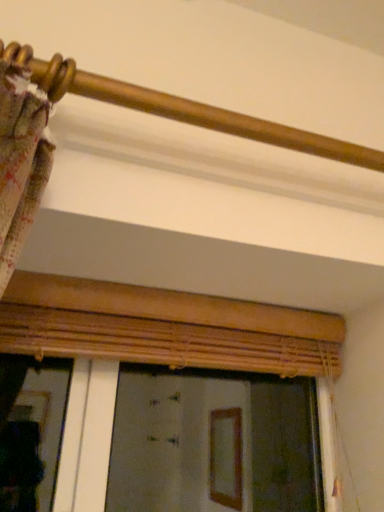
Question: Is wooden blinds at center directly adjacent to gold polished rod at upper center?

Choices:
 (A) no
 (B) yes

Answer: (A)

Question: Does wooden blinds at center have a lesser width compared to gold polished rod at upper center?

Choices:
 (A) yes
 (B) no

Answer: (B)

Question: Can we say wooden blinds at center lies outside gold polished rod at upper center?

Choices:
 (A) no
 (B) yes

Answer: (B)

Question: Can you confirm if wooden blinds at center is wider than gold polished rod at upper center?

Choices:
 (A) yes
 (B) no

Answer: (A)

Question: From a real-world perspective, is wooden blinds at center on top of gold polished rod at upper center?

Choices:
 (A) yes
 (B) no

Answer: (B)

Question: Can you confirm if wooden blinds at center is positioned to the right of gold polished rod at upper center?

Choices:
 (A) no
 (B) yes

Answer: (A)

Question: Is gold polished rod at upper center positioned far away from wooden blinds at center?

Choices:
 (A) yes
 (B) no

Answer: (B)

Question: Does gold polished rod at upper center have a greater height compared to wooden blinds at center?

Choices:
 (A) no
 (B) yes

Answer: (A)

Question: Can you confirm if gold polished rod at upper center is thinner than wooden blinds at center?

Choices:
 (A) yes
 (B) no

Answer: (A)

Question: From a real-world perspective, is gold polished rod at upper center physically above wooden blinds at center?

Choices:
 (A) yes
 (B) no

Answer: (A)

Question: Considering the relative positions of gold polished rod at upper center and wooden blinds at center in the image provided, is gold polished rod at upper center behind wooden blinds at center?

Choices:
 (A) no
 (B) yes

Answer: (A)

Question: From a real-world perspective, is gold polished rod at upper center beneath wooden blinds at center?

Choices:
 (A) no
 (B) yes

Answer: (A)

Question: Considering the positions of wooden blinds at center and gold polished rod at upper center in the image, is wooden blinds at center taller or shorter than gold polished rod at upper center?

Choices:
 (A) short
 (B) tall

Answer: (B)